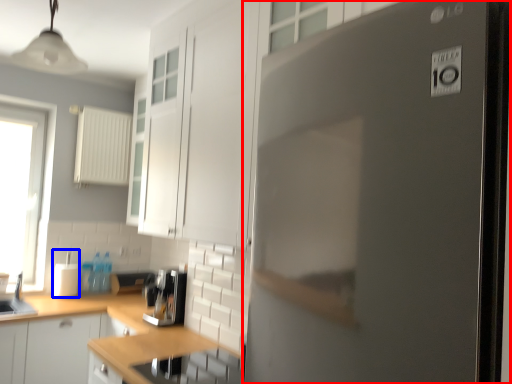
Question: Which object appears farthest to the camera in this image, refrigerator (highlighted by a red box) or appliance (highlighted by a blue box)?

Choices:
 (A) refrigerator
 (B) appliance

Answer: (B)